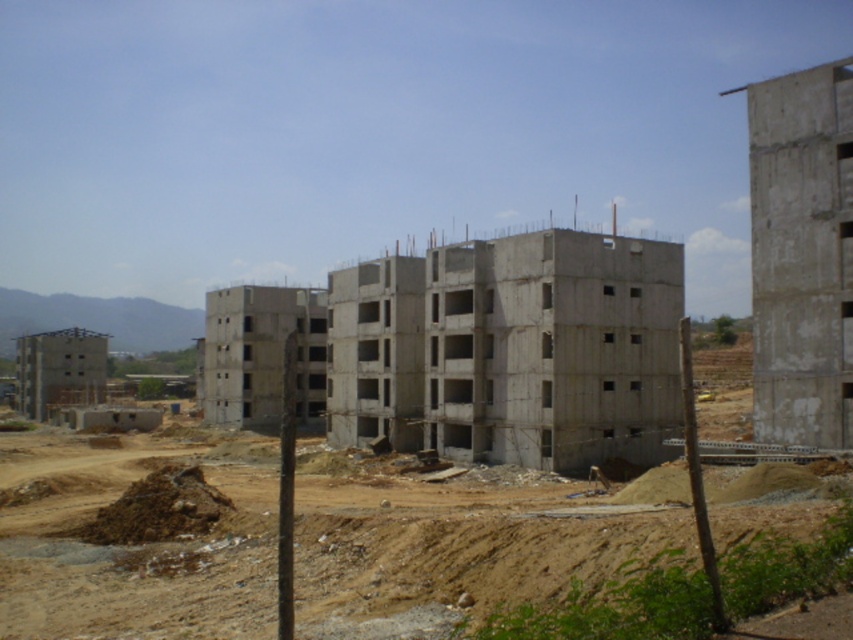
Question: Does brown sandy dirt field at center have a larger size compared to concrete building at center?

Choices:
 (A) no
 (B) yes

Answer: (B)

Question: Is brown sandy dirt field at center bigger than concrete building at center?

Choices:
 (A) yes
 (B) no

Answer: (A)

Question: In this image, where is brown sandy dirt field at center located relative to concrete building at center?

Choices:
 (A) left
 (B) right

Answer: (A)

Question: Which object is farther from the camera taking this photo?

Choices:
 (A) brown sandy dirt field at center
 (B) concrete building at center

Answer: (B)